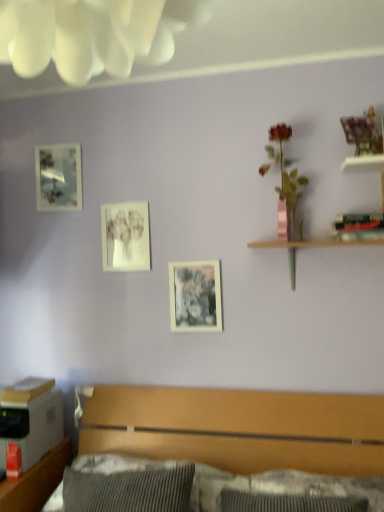
Question: Which direction should I rotate to look at matte paper picture frame at center, which ranks as the 2th picture frame in right-to-left order, — up or down?

Choices:
 (A) up
 (B) down

Answer: (A)

Question: Is pink metallic vase at upper right closer to camera compared to black matte picture frame at center, which is counted as the first picture frame, starting from the bottom?

Choices:
 (A) no
 (B) yes

Answer: (B)

Question: From a real-world perspective, is pink metallic vase at upper right below black matte picture frame at center, the 3th picture frame when ordered from left to right?

Choices:
 (A) yes
 (B) no

Answer: (B)

Question: Is pink metallic vase at upper right next to black matte picture frame at center, which appears as the third picture frame when viewed from the back?

Choices:
 (A) no
 (B) yes

Answer: (A)

Question: Is pink metallic vase at upper right turned away from black matte picture frame at center, marked as the 1th picture frame in a right-to-left arrangement?

Choices:
 (A) yes
 (B) no

Answer: (B)

Question: Is pink metallic vase at upper right further to the viewer compared to black matte picture frame at center, positioned as the first picture frame in front-to-back order?

Choices:
 (A) no
 (B) yes

Answer: (A)

Question: Is black matte picture frame at center, the 3th picture frame in the top-to-bottom sequence, surrounded by pink metallic vase at upper right?

Choices:
 (A) no
 (B) yes

Answer: (A)

Question: Can you confirm if matte paper picture frame at center, placed as the 2th picture frame when sorted from top to bottom, is thinner than wooden bed at lower center?

Choices:
 (A) yes
 (B) no

Answer: (A)

Question: Is the position of matte paper picture frame at center, which is the 2th picture frame from left to right, less distant than that of wooden bed at lower center?

Choices:
 (A) no
 (B) yes

Answer: (A)

Question: Is matte paper picture frame at center, which ranks as the 2th picture frame in right-to-left order, to the right of wooden bed at lower center from the viewer's perspective?

Choices:
 (A) yes
 (B) no

Answer: (B)

Question: Could you tell me if matte paper picture frame at center, which ranks as the 2th picture frame in right-to-left order, is turned towards wooden bed at lower center?

Choices:
 (A) yes
 (B) no

Answer: (B)

Question: Is matte paper picture frame at center, marked as the second picture frame in a front-to-back arrangement, oriented away from wooden bed at lower center?

Choices:
 (A) yes
 (B) no

Answer: (B)

Question: Is black matte picture frame at center, which appears as the third picture frame when viewed from the back, positioned before brushed wood dresser at lower left?

Choices:
 (A) yes
 (B) no

Answer: (B)